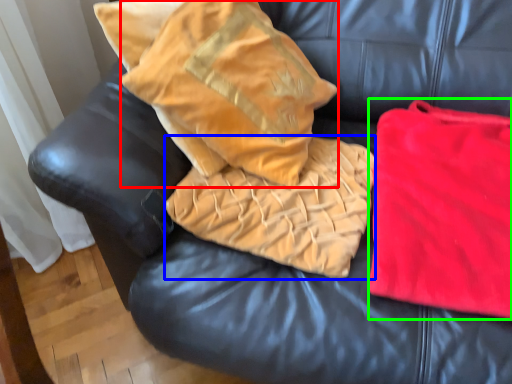
Question: Which object is positioned closest to throw pillow (highlighted by a red box)? Select from cloth (highlighted by a blue box) and material (highlighted by a green box).

Choices:
 (A) cloth
 (B) material

Answer: (A)